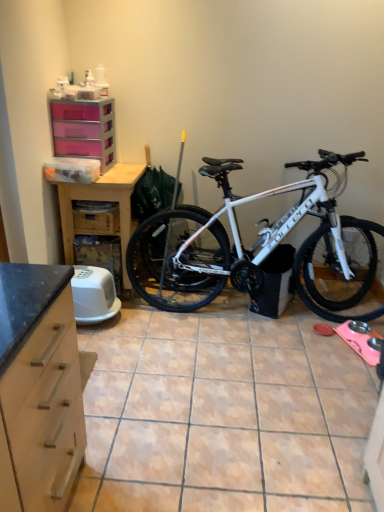
Find the location of a particular element. This screenshot has height=512, width=384. pink plastic drawers at upper left is located at coordinates (84, 129).

You are a GUI agent. You are given a task and a screenshot of the screen. Output one action in this format:
    pyautogui.click(x=<x>, y=<y>)
    Task: Click on the wooden table at left
    
    Given the screenshot: What is the action you would take?
    pyautogui.click(x=101, y=200)

At what (x,y) coordinates should I click in order to perform the action: click on white matte bicycle at center. Please return your answer as a coordinate pair (x, y). Looking at the image, I should click on (260, 247).

Considering the points (78, 214) and (322, 384), which point is in front, point (78, 214) or point (322, 384)?

The point (322, 384) is in front.

From the image's perspective, is brown cardboard crate at lower left below porcelain tile at center?

No.

Visually, is brown cardboard crate at lower left positioned to the left or to the right of porcelain tile at center?

Clearly, brown cardboard crate at lower left is on the left of porcelain tile at center in the image.

In the scene shown: Can you confirm if brown cardboard crate at lower left is wider than porcelain tile at center?

No.

From a real-world perspective, which object stands above the other?

From a 3D spatial view, pink plastic drawers at upper left is above.

What's the angular difference between porcelain tile at center and pink plastic drawers at upper left's facing directions?

1.08 degrees separate the facing orientations of porcelain tile at center and pink plastic drawers at upper left.

From the image's perspective, which object appears higher, porcelain tile at center or pink plastic drawers at upper left?

pink plastic drawers at upper left.

Considering the sizes of porcelain tile at center and pink plastic drawers at upper left in the image, is porcelain tile at center wider or thinner than pink plastic drawers at upper left?

In the image, porcelain tile at center appears to be wider than pink plastic drawers at upper left.

Is pink plastic drawers at upper left closer to the viewer compared to brown cardboard crate at lower left?

Yes, it is in front of brown cardboard crate at lower left.

The image size is (384, 512). What are the coordinates of `crate located below the pink plastic drawers at upper left (from the image's perspective)` in the screenshot? It's located at (97, 216).

Between pink plastic drawers at upper left and brown cardboard crate at lower left, which one appears on the left side from the viewer's perspective?

pink plastic drawers at upper left.

Is brown cardboard crate at lower left next to white matte bicycle at center and touching it?

brown cardboard crate at lower left is not next to white matte bicycle at center, and they're not touching.

From the image's perspective, which one is positioned lower, brown cardboard crate at lower left or white matte bicycle at center?

white matte bicycle at center.

The height and width of the screenshot is (512, 384). Identify the location of crate above the white matte bicycle at center (from the image's perspective). (97, 216).

From the image's perspective, is wooden table at left positioned above or below porcelain tile at center?

From the image's perspective, wooden table at left appears above porcelain tile at center.

Can you confirm if wooden table at left is smaller than porcelain tile at center?

Incorrect, wooden table at left is not smaller in size than porcelain tile at center.

Based on the photo, is wooden table at left oriented away from porcelain tile at center?

No, wooden table at left is not facing the opposite direction of porcelain tile at center.

From a real-world perspective, is wooden table at left physically located above or below porcelain tile at center?

From a real-world perspective, wooden table at left is physically above porcelain tile at center.

Are wooden table at left and white matte bicycle at center far apart?

They are positioned close to each other.

Looking at this image, considering the sizes of objects wooden table at left and white matte bicycle at center in the image provided, who is wider, wooden table at left or white matte bicycle at center?

With larger width is wooden table at left.

From the image's perspective, is wooden table at left beneath white matte bicycle at center?

No, from the image's perspective, wooden table at left is not below white matte bicycle at center.

Could you tell me if wooden table at left is turned towards white matte bicycle at center?

No, wooden table at left is not facing towards white matte bicycle at center.

From the picture: Do you think porcelain tile at center is within wooden table at left, or outside of it?

porcelain tile at center is outside wooden table at left.

Does porcelain tile at center have a greater width compared to wooden table at left?

Yes, porcelain tile at center is wider than wooden table at left.

Is porcelain tile at center not near wooden table at left?

Yes, porcelain tile at center is far from wooden table at left.

This screenshot has width=384, height=512. Find the location of `table lying above the porcelain tile at center (from the image's perspective)`. table lying above the porcelain tile at center (from the image's perspective) is located at coordinates (101, 200).

Where is `crate above the porcelain tile at center (from the image's perspective)`? The height and width of the screenshot is (512, 384). crate above the porcelain tile at center (from the image's perspective) is located at coordinates (97, 216).

Locate an element on the screen. file cabinet on the left side of porcelain tile at center is located at coordinates (84, 129).

Considering their positions, is porcelain tile at center positioned further to pink plastic drawers at upper left than brown cardboard crate at lower left?

porcelain tile at center lies further to pink plastic drawers at upper left than the other object.

From the image, which object appears to be nearer to wooden table at left, brown cardboard crate at lower left or white matte bicycle at center?

brown cardboard crate at lower left is positioned closer to the anchor wooden table at left.

Which object lies nearer to the anchor point pink plastic drawers at upper left, white matte bicycle at center or porcelain tile at center?

white matte bicycle at center lies closer to pink plastic drawers at upper left than the other object.

Considering their positions, is wooden table at left positioned closer to brown cardboard crate at lower left than porcelain tile at center?

The object closer to brown cardboard crate at lower left is wooden table at left.

Considering their positions, is porcelain tile at center positioned closer to wooden table at left than brown cardboard crate at lower left?

The object closer to wooden table at left is brown cardboard crate at lower left.

Based on their spatial positions, is wooden table at left or brown cardboard crate at lower left closer to pink plastic drawers at upper left?

wooden table at left.

Based on the photo, looking at the image, which one is located closer to brown cardboard crate at lower left, white matte bicycle at center or wooden table at left?

Based on the image, wooden table at left appears to be nearer to brown cardboard crate at lower left.

Which object lies nearer to the anchor point brown cardboard crate at lower left, porcelain tile at center or wooden table at left?

wooden table at left is positioned closer to the anchor brown cardboard crate at lower left.

Locate an element on the screen. table between pink plastic drawers at upper left and white matte bicycle at center is located at coordinates (101, 200).

Identify the location of tile located between wooden table at left and white matte bicycle at center in the left-right direction. The width and height of the screenshot is (384, 512). (223, 413).

Where is `crate that lies between pink plastic drawers at upper left and wooden table at left from top to bottom`? crate that lies between pink plastic drawers at upper left and wooden table at left from top to bottom is located at coordinates (97, 216).

The image size is (384, 512). Identify the location of table between brown cardboard crate at lower left and white matte bicycle at center. (101, 200).